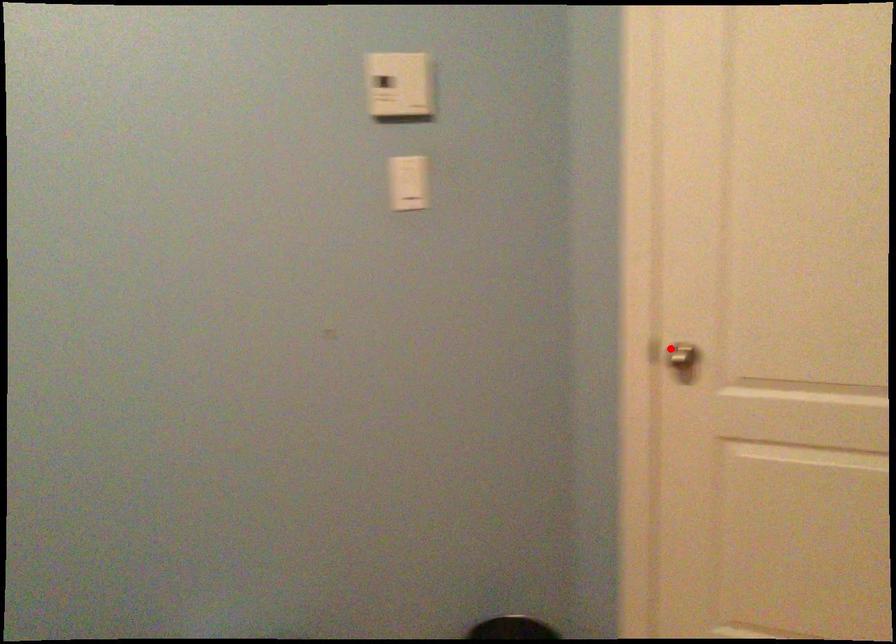
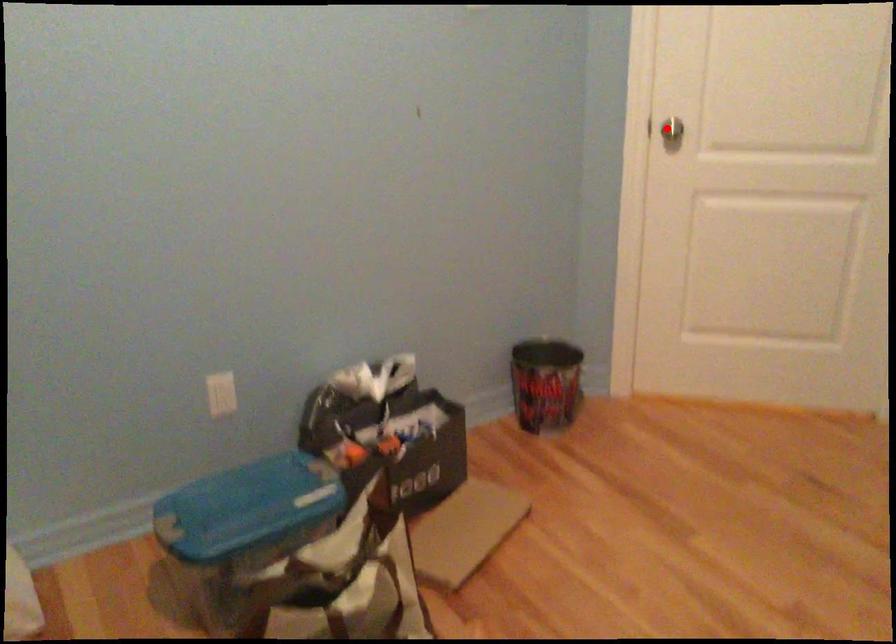
Looking at this image, I am providing you with two images of the same scene from different viewpoints. A red point is marked on the first image and another point is marked on the second image. Is the marked point in image1 the same physical position as the marked point in image2?

Yes